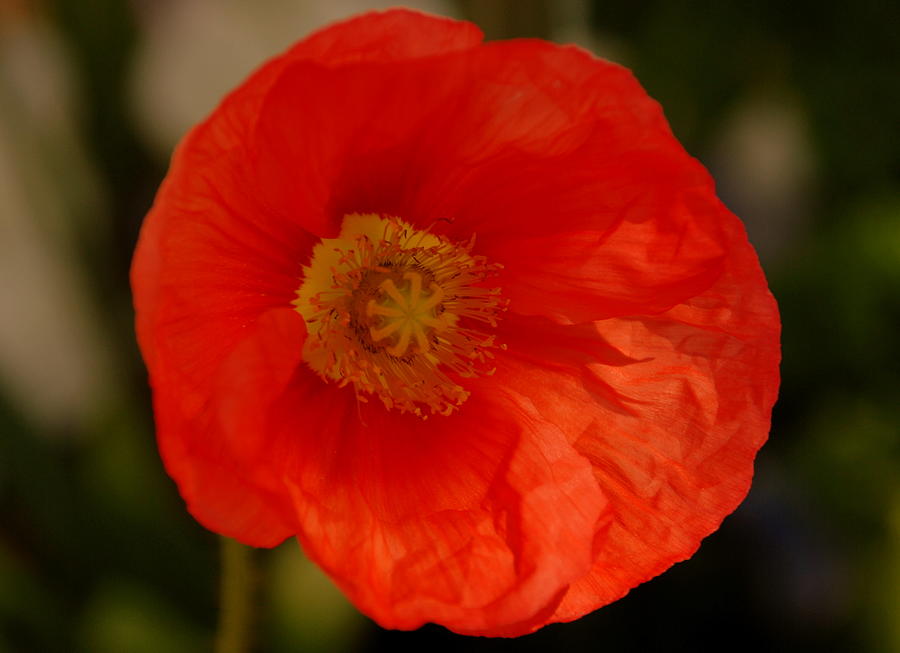
The width and height of the screenshot is (900, 653). I want to click on light area, so click(x=652, y=381), click(x=561, y=513), click(x=636, y=558).